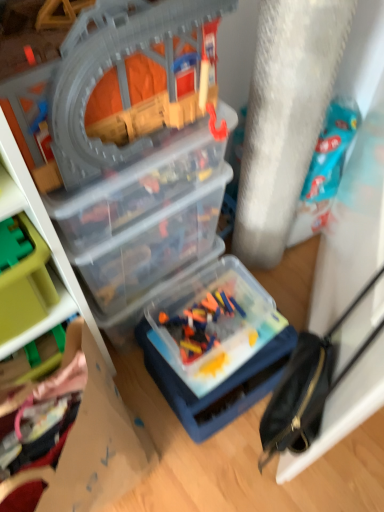
Question: From a real-world perspective, relative to green plastic toy at left, which is counted as the third toy, starting from the top, is plush pink blanket at lower left, which appears as the fifth toy when viewed from the top, vertically above or below?

Choices:
 (A) above
 (B) below

Answer: (B)

Question: Is plush pink blanket at lower left, which appears as the fifth toy when viewed from the top, situated inside green plastic toy at left, acting as the 3th toy starting from the bottom, or outside?

Choices:
 (A) inside
 (B) outside

Answer: (B)

Question: Which object is the closest to the green plastic toy at left, which is counted as the third toy, starting from the top?

Choices:
 (A) transparent plastic toy box at upper left, the 1th box when ordered from front to back
 (B) plush pink blanket at lower left, the 1th toy ordered from the bottom
 (C) translucent plastic container at center, which is the 2th box from front to back
 (D) transparent plastic train set at upper left, which is the fifth toy from bottom to top
 (E) black leather bag at right

Answer: (B)

Question: Based on their relative distances, which object is nearer to the plush pink blanket at lower left, the 1th toy ordered from the bottom?

Choices:
 (A) black leather bag at right
 (B) translucent plastic container at center, placed as the fourth toy when sorted from top to bottom
 (C) transparent plastic train set at upper left, which is the fifth toy from bottom to top
 (D) transparent plastic toy box at upper left, arranged as the second box when viewed from the back
 (E) cardboard at lower left

Answer: (E)